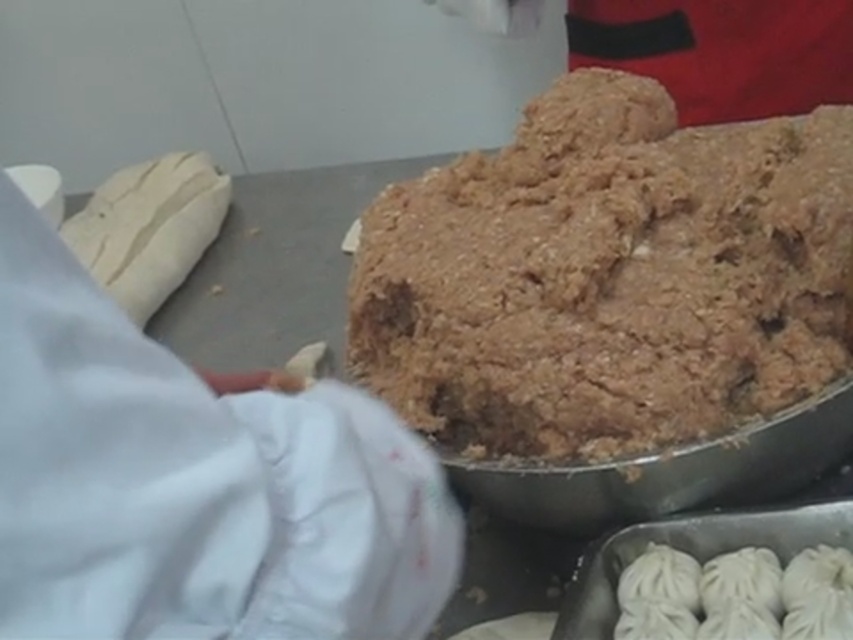
Who is higher up, white fabric glove at upper left or white matte dumplings at lower right?

Positioned higher is white fabric glove at upper left.

Is white fabric glove at upper left smaller than white matte dumplings at lower right?

No, white fabric glove at upper left is not smaller than white matte dumplings at lower right.

The height and width of the screenshot is (640, 853). What do you see at coordinates (193, 483) in the screenshot?
I see `white fabric glove at upper left` at bounding box center [193, 483].

At what (x,y) coordinates should I click in order to perform the action: click on white fabric glove at upper left. Please return your answer as a coordinate pair (x, y). Image resolution: width=853 pixels, height=640 pixels. Looking at the image, I should click on (193, 483).

Which is behind, point (595, 106) or point (838, 602)?

The point (595, 106) is behind.

Which is behind, point (500, 419) or point (683, 582)?

The point (500, 419) is more distant.

You are a GUI agent. You are given a task and a screenshot of the screen. Output one action in this format:
    pyautogui.click(x=<x>, y=<y>)
    Task: Click on the brown crumbly dough at center
    The height and width of the screenshot is (640, 853).
    Given the screenshot: What is the action you would take?
    pyautogui.click(x=607, y=276)

Does brown crumbly dough at center have a lesser height compared to white fabric glove at upper left?

In fact, brown crumbly dough at center may be taller than white fabric glove at upper left.

Where is `brown crumbly dough at center`? The height and width of the screenshot is (640, 853). brown crumbly dough at center is located at coordinates (607, 276).